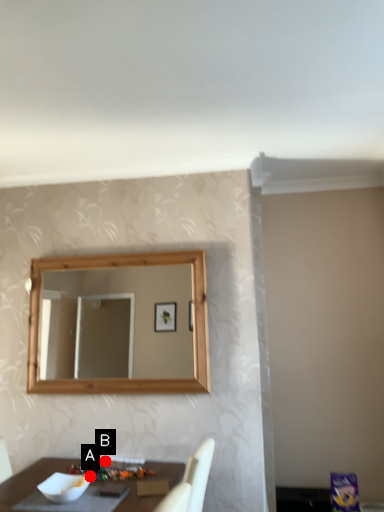
Question: Two points are circled on the image, labeled by A and B beside each circle. Which point is farther to the camera?

Choices:
 (A) A is further
 (B) B is further

Answer: (B)